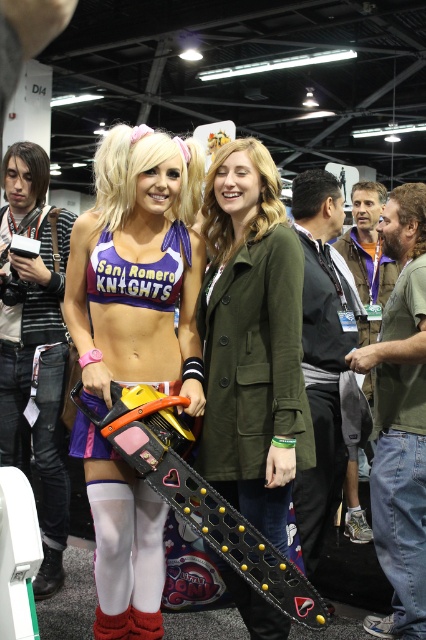
Between purple matte sports bra at center and green matte jacket at center, which one is positioned lower?

green matte jacket at center

Can you confirm if purple matte sports bra at center is positioned above green matte jacket at center?

Yes.

Between point (89, 428) and point (270, 625), which one is positioned behind?

Positioned behind is point (89, 428).

Find the location of `purple matte sports bra at center`. purple matte sports bra at center is located at coordinates (138, 268).

Between black plastic chainsaw at lower center and purple fabric bikini top at center, which one appears on the left side from the viewer's perspective?

purple fabric bikini top at center

In order to click on black plastic chainsaw at lower center in this screenshot , I will do `click(199, 496)`.

Who is lower down, green matte jacket at center or black plastic chainsaw at lower center?

Positioned lower is black plastic chainsaw at lower center.

Between green matte jacket at center and black plastic chainsaw at lower center, which one has less height?

With less height is black plastic chainsaw at lower center.

This screenshot has height=640, width=426. Find the location of `green matte jacket at center`. green matte jacket at center is located at coordinates (252, 340).

At what (x,y) coordinates should I click in order to perform the action: click on green matte jacket at center. Please return your answer as a coordinate pair (x, y). This screenshot has width=426, height=640. Looking at the image, I should click on (252, 340).